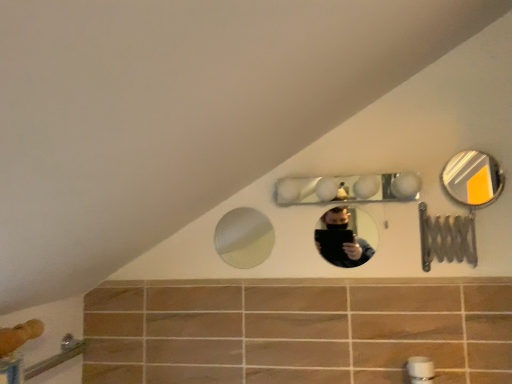
Question: From a real-world perspective, is clear glass mirror at upper center, the 2th mirror when ordered from right to left, above or below metallic silver mirror at upper right, which is counted as the first mirror, starting from the right?

Choices:
 (A) below
 (B) above

Answer: (A)

Question: Considering the positions of clear glass mirror at upper center, the 3th mirror viewed from the left, and metallic silver mirror at upper right, which is counted as the first mirror, starting from the right, in the image, is clear glass mirror at upper center, the 3th mirror viewed from the left, taller or shorter than metallic silver mirror at upper right, which is counted as the first mirror, starting from the right,?

Choices:
 (A) tall
 (B) short

Answer: (B)

Question: Considering the real-world distances, which object is farthest from the white glossy mirror at upper center, which is the third mirror from right to left?

Choices:
 (A) metallic silver mirror at upper right, which is counted as the first mirror, starting from the right
 (B) white textured mirror at center, the fourth mirror positioned from the right
 (C) clear glass mirror at upper center, the 2th mirror when ordered from right to left

Answer: (B)

Question: Considering the real-world distances, which object is closest to the white textured mirror at center, the fourth mirror positioned from the right?

Choices:
 (A) clear glass mirror at upper center, the 3th mirror viewed from the left
 (B) white glossy mirror at upper center, positioned as the second mirror in left-to-right order
 (C) metallic silver mirror at upper right, arranged as the fourth mirror when viewed from the left

Answer: (A)